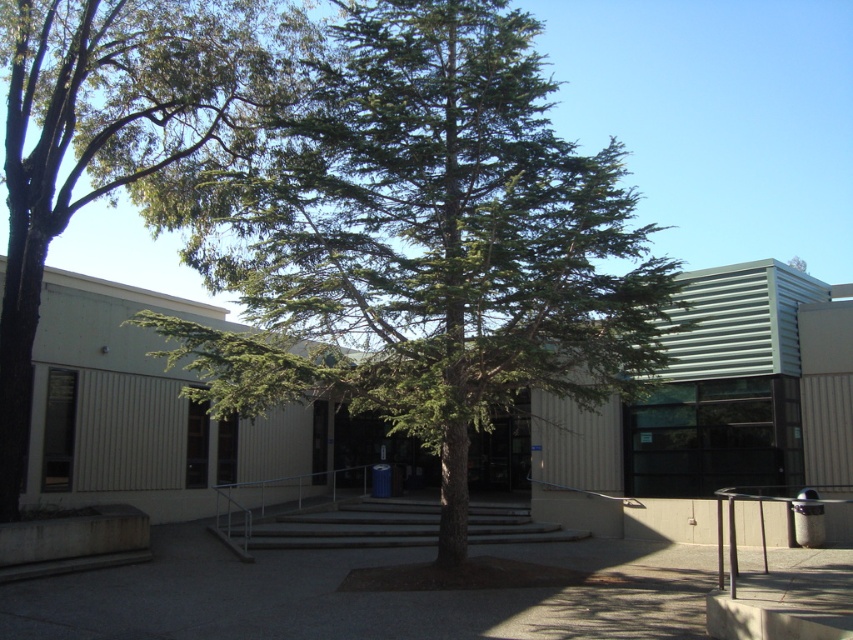
Question: Among these objects, which one is farthest from the camera?

Choices:
 (A) green leafy tree at center
 (B) green textured tree at center
 (C) gray concrete stairs at center

Answer: (C)

Question: Can you confirm if green textured tree at center is positioned to the right of gray concrete stairs at center?

Choices:
 (A) yes
 (B) no

Answer: (A)

Question: Which of the following is the closest to the observer?

Choices:
 (A) gray concrete stairs at center
 (B) green textured tree at center
 (C) green leafy tree at center

Answer: (B)

Question: Considering the relative positions of green leafy tree at center and gray concrete stairs at center in the image provided, where is green leafy tree at center located with respect to gray concrete stairs at center?

Choices:
 (A) below
 (B) above

Answer: (B)

Question: Does green textured tree at center have a greater width compared to gray concrete stairs at center?

Choices:
 (A) no
 (B) yes

Answer: (B)

Question: Which point is farther to the camera?

Choices:
 (A) (248, 154)
 (B) (160, 204)
 (C) (296, 536)

Answer: (C)